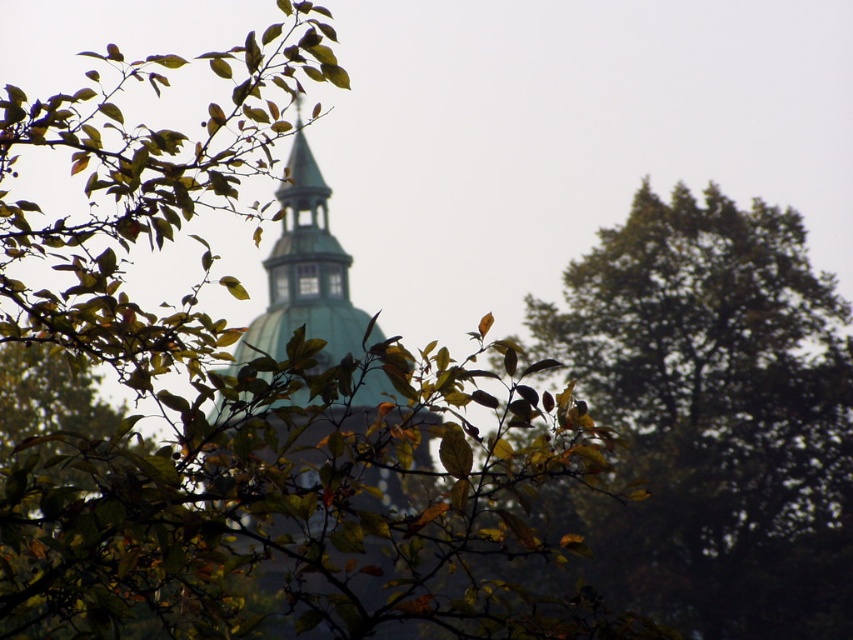
Question: Can you confirm if green leafy tree at upper right is thinner than green copper dome at center?

Choices:
 (A) yes
 (B) no

Answer: (B)

Question: Which point is farther from the camera taking this photo?

Choices:
 (A) (743, 556)
 (B) (367, 371)

Answer: (A)

Question: Among these points, which one is farthest from the camera?

Choices:
 (A) (704, 612)
 (B) (292, 186)

Answer: (B)

Question: Does green leafy tree at upper right have a lesser width compared to green copper dome at center?

Choices:
 (A) yes
 (B) no

Answer: (B)

Question: Among these objects, which one is farthest from the camera?

Choices:
 (A) green leafy tree at upper right
 (B) green copper dome at center

Answer: (A)

Question: Can you confirm if green leafy tree at upper right is smaller than green copper dome at center?

Choices:
 (A) yes
 (B) no

Answer: (A)